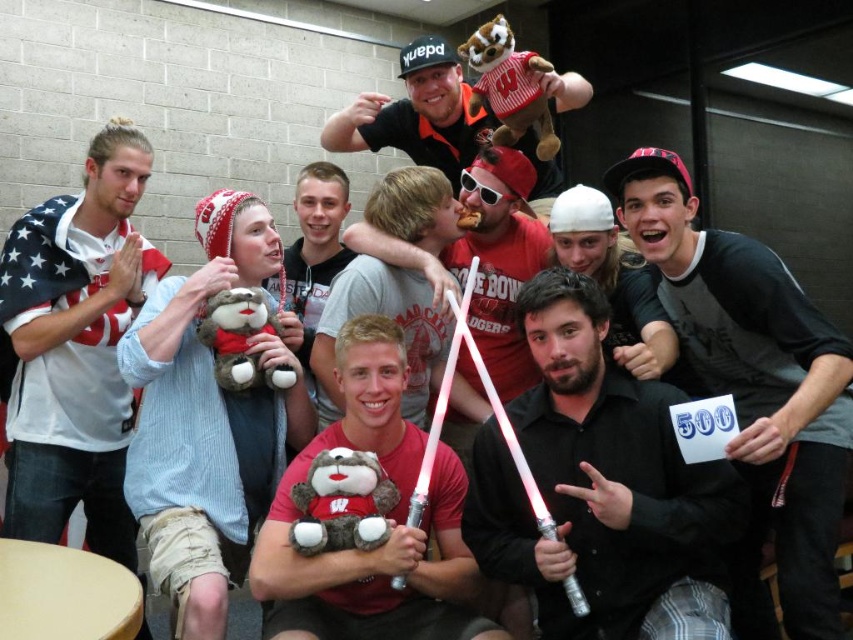
You are a photographer trying to capture a candid shot of the black matte shirt at center and the soft plush bear at center. Which object should you focus on first if you want to ensure both are in focus without adjusting your camera settings?

The black matte shirt at center is above the soft plush bear at center, so focusing on the black matte shirt at center first will help ensure both are in focus since it is closer to the camera.

You are a photographer trying to capture a group photo of the black matte shirt at center and the white cotton shirt at left. You want to ensure both subjects are visible in the frame. Based on their positions, which one should you focus on first to avoid missing them in the shot?

The black matte shirt at center is located below the white cotton shirt at left, so you should focus on the white cotton shirt at left first to ensure it stays in the frame.